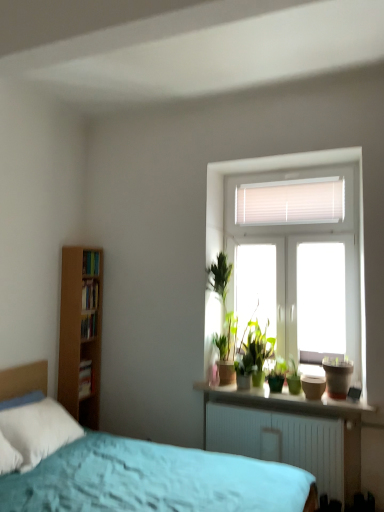
Question: Can you confirm if matte brown flowerpot at right is shorter than smooth concrete window sill at center?

Choices:
 (A) no
 (B) yes

Answer: (A)

Question: Does matte brown flowerpot at right have a smaller size compared to smooth concrete window sill at center?

Choices:
 (A) yes
 (B) no

Answer: (A)

Question: Is smooth concrete window sill at center completely or partially inside matte brown flowerpot at right?

Choices:
 (A) no
 (B) yes

Answer: (A)

Question: Is matte brown flowerpot at right thinner than smooth concrete window sill at center?

Choices:
 (A) yes
 (B) no

Answer: (A)

Question: Is matte brown flowerpot at right taller than smooth concrete window sill at center?

Choices:
 (A) no
 (B) yes

Answer: (B)

Question: From a real-world perspective, relative to green matte houseplant at center, is matte brown flowerpot at right vertically above or below?

Choices:
 (A) above
 (B) below

Answer: (A)

Question: From the image's perspective, relative to green matte houseplant at center, is matte brown flowerpot at right above or below?

Choices:
 (A) above
 (B) below

Answer: (A)

Question: In terms of size, does matte brown flowerpot at right appear bigger or smaller than green matte houseplant at center?

Choices:
 (A) small
 (B) big

Answer: (B)

Question: Considering the positions of matte brown flowerpot at right and green matte houseplant at center in the image, is matte brown flowerpot at right wider or thinner than green matte houseplant at center?

Choices:
 (A) wide
 (B) thin

Answer: (A)

Question: From a real-world perspective, is hardcover book at left, the 3th book positioned from the top, positioned above or below wooden bookshelf at left, which appears as the 2th book when viewed from the top?

Choices:
 (A) below
 (B) above

Answer: (A)

Question: From the image's perspective, is hardcover book at left, which appears as the second book when ordered from the bottom, positioned above or below wooden bookshelf at left, which appears as the 2th book when viewed from the top?

Choices:
 (A) below
 (B) above

Answer: (A)

Question: Considering the positions of hardcover book at left, the 3th book positioned from the top, and wooden bookshelf at left, the third book when ordered from bottom to top, in the image, is hardcover book at left, the 3th book positioned from the top, taller or shorter than wooden bookshelf at left, the third book when ordered from bottom to top,?

Choices:
 (A) tall
 (B) short

Answer: (B)

Question: Looking at their shapes, would you say hardcover book at left, the 3th book positioned from the top, is wider or thinner than wooden bookshelf at left, the third book when ordered from bottom to top?

Choices:
 (A) wide
 (B) thin

Answer: (A)

Question: From a real-world perspective, is hardcover books at left, which is the fourth book from bottom to top, positioned above or below hardcover book at left, which appears as the second book when ordered from the bottom?

Choices:
 (A) above
 (B) below

Answer: (A)

Question: Considering the positions of hardcover books at left, which is the fourth book from bottom to top, and hardcover book at left, which appears as the second book when ordered from the bottom, in the image, is hardcover books at left, which is the fourth book from bottom to top, bigger or smaller than hardcover book at left, which appears as the second book when ordered from the bottom,?

Choices:
 (A) big
 (B) small

Answer: (A)